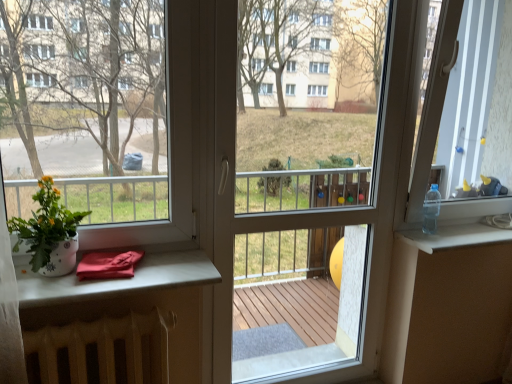
Question: Is white radiator at lower left, the 1th table positioned from the bottom, in contact with white glossy pot at left?

Choices:
 (A) yes
 (B) no

Answer: (B)

Question: From a real-world perspective, is white radiator at lower left, the 1th table positioned from the bottom, on top of white glossy pot at left?

Choices:
 (A) no
 (B) yes

Answer: (A)

Question: From the image's perspective, does white radiator at lower left, the 1th table positioned from the bottom, appear higher than white glossy pot at left?

Choices:
 (A) yes
 (B) no

Answer: (B)

Question: Is white radiator at lower left, marked as the 2th table in a top-to-bottom arrangement, at the left side of white glossy pot at left?

Choices:
 (A) yes
 (B) no

Answer: (B)

Question: From the image's perspective, does white radiator at lower left, marked as the 2th table in a top-to-bottom arrangement, appear lower than white glossy pot at left?

Choices:
 (A) no
 (B) yes

Answer: (B)

Question: Considering the positions of point (181, 269) and point (456, 241), is point (181, 269) closer or farther from the camera than point (456, 241)?

Choices:
 (A) farther
 (B) closer

Answer: (B)

Question: From the image's perspective, is matte white table at lower left, which is the second table from bottom to top, above or below transparent plastic bottle at upper right?

Choices:
 (A) above
 (B) below

Answer: (B)

Question: Choose the correct answer: Is matte white table at lower left, which is the second table from bottom to top, inside transparent plastic bottle at upper right or outside it?

Choices:
 (A) outside
 (B) inside

Answer: (A)

Question: Based on their sizes in the image, would you say matte white table at lower left, placed as the 1th table when sorted from top to bottom, is bigger or smaller than transparent plastic bottle at upper right?

Choices:
 (A) small
 (B) big

Answer: (B)

Question: Is clear plastic bottle at upper right wider or thinner than white glossy pot at left?

Choices:
 (A) wide
 (B) thin

Answer: (B)

Question: Is clear plastic bottle at upper right bigger or smaller than white glossy pot at left?

Choices:
 (A) big
 (B) small

Answer: (B)

Question: Is clear plastic bottle at upper right to the left or to the right of white glossy pot at left in the image?

Choices:
 (A) right
 (B) left

Answer: (A)

Question: Is point (434, 196) positioned closer to the camera than point (40, 226)?

Choices:
 (A) farther
 (B) closer

Answer: (A)

Question: Would you say transparent plastic bottle at upper right is inside or outside white glossy pot at left?

Choices:
 (A) outside
 (B) inside

Answer: (A)

Question: Considering the positions of transparent plastic bottle at upper right and white glossy pot at left in the image, is transparent plastic bottle at upper right wider or thinner than white glossy pot at left?

Choices:
 (A) thin
 (B) wide

Answer: (B)